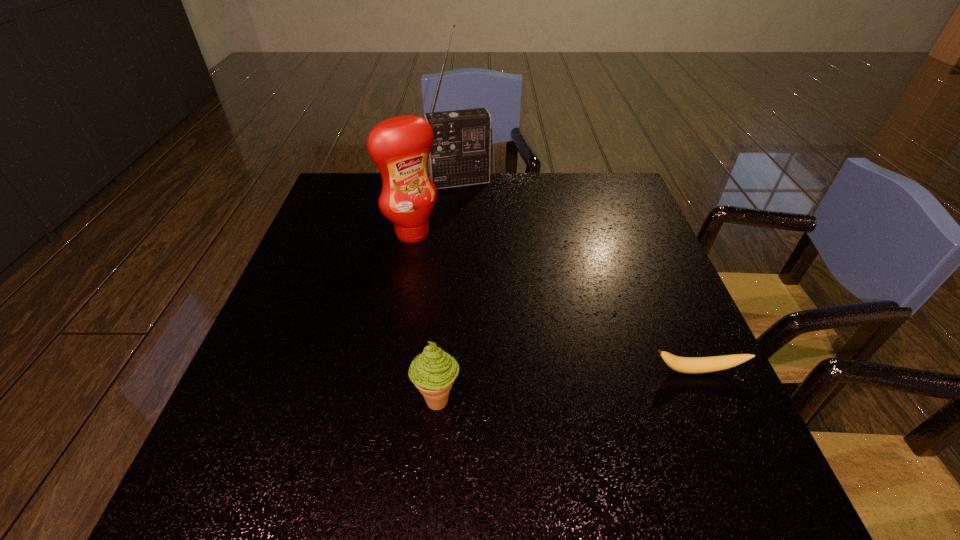
Where is `vacant region at the left edge of the desktop`? The image size is (960, 540). vacant region at the left edge of the desktop is located at coordinates (329, 273).

In the image, there is a desktop. Identify the location of vacant space at the right edge. This screenshot has height=540, width=960. (622, 326).

Identify the location of blank space at the far left corner of the desktop. (353, 194).

In the image, there is a desktop. In order to click on vacant space at the near right corner in this screenshot , I will do `click(681, 403)`.

Locate an element on the screen. This screenshot has width=960, height=540. vacant space that's between the second farthest object and the second nearest object is located at coordinates (555, 301).

You are a GUI agent. You are given a task and a screenshot of the screen. Output one action in this format:
    pyautogui.click(x=<x>, y=<y>)
    Task: Click on the vacant space that's between the banana and the icecream
    Image resolution: width=960 pixels, height=540 pixels.
    Given the screenshot: What is the action you would take?
    pyautogui.click(x=567, y=385)

The width and height of the screenshot is (960, 540). Identify the location of free space between the rightmost object and the radio receiver. (579, 276).

Image resolution: width=960 pixels, height=540 pixels. What are the coordinates of `free space that is in between the second shortest object and the tallest object` in the screenshot? It's located at (449, 291).

Image resolution: width=960 pixels, height=540 pixels. Identify the location of vacant space that is in between the condiment and the shortest object. (555, 301).

Identify the location of free space that is in between the nearest object and the tallest object. Image resolution: width=960 pixels, height=540 pixels. (449, 291).